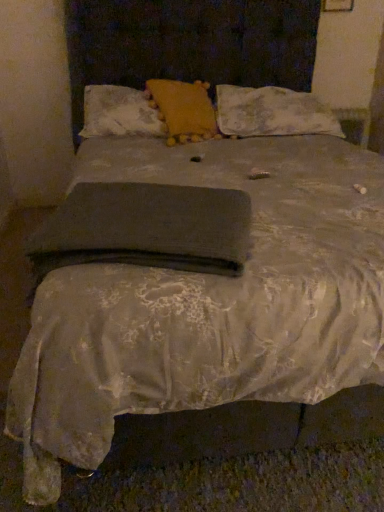
Measure the distance between dark gray fabric at center and camera.

The distance of dark gray fabric at center from camera is 36.14 inches.

What do you see at coordinates (272, 113) in the screenshot?
I see `floral lace pillow at upper right, which appears as the 3th pillow when viewed from the left` at bounding box center [272, 113].

Image resolution: width=384 pixels, height=512 pixels. I want to click on yellow fabric pillow at center, which ranks as the 2th pillow in right-to-left order, so click(184, 110).

Locate an element on the screen. dark gray fabric at center is located at coordinates (146, 228).

Which object is thinner, dark gray fabric at center or floral lace pillow at upper right, the 1th pillow when ordered from right to left?

With smaller width is dark gray fabric at center.

Which is more to the right, dark gray fabric at center or floral lace pillow at upper right, which appears as the 3th pillow when viewed from the left?

floral lace pillow at upper right, which appears as the 3th pillow when viewed from the left, is more to the right.

Is dark gray fabric at center not inside floral lace pillow at upper right, which appears as the 3th pillow when viewed from the left?

Yes.

Consider the image. Is dark gray fabric at center bigger or smaller than floral lace pillow at upper right, the 1th pillow when ordered from right to left?

In the image, dark gray fabric at center appears to be smaller than floral lace pillow at upper right, the 1th pillow when ordered from right to left.

Do you think matte yellow pillow at upper center, placed as the 3th pillow when sorted from right to left, is within yellow fabric pillow at center, which ranks as the 2th pillow in right-to-left order, or outside of it?

matte yellow pillow at upper center, placed as the 3th pillow when sorted from right to left, fits inside yellow fabric pillow at center, which ranks as the 2th pillow in right-to-left order.

Between matte yellow pillow at upper center, placed as the 3th pillow when sorted from right to left, and yellow fabric pillow at center, the second pillow from the left, which one appears on the right side from the viewer's perspective?

yellow fabric pillow at center, the second pillow from the left.

In the scene shown: In the image, is matte yellow pillow at upper center, which is counted as the 1th pillow, starting from the left, positioned in front of or behind yellow fabric pillow at center, the second pillow from the left?

matte yellow pillow at upper center, which is counted as the 1th pillow, starting from the left, is positioned farther from the viewer than yellow fabric pillow at center, the second pillow from the left.

From the image's perspective, is matte yellow pillow at upper center, placed as the 3th pillow when sorted from right to left, below yellow fabric pillow at center, which ranks as the 2th pillow in right-to-left order?

Yes, from the image's perspective, matte yellow pillow at upper center, placed as the 3th pillow when sorted from right to left, is below yellow fabric pillow at center, which ranks as the 2th pillow in right-to-left order.

From the image's perspective, who appears lower, yellow fabric pillow at center, the second pillow from the left, or dark gray fabric at center?

From the image's view, dark gray fabric at center is below.

How many degrees apart are the facing directions of yellow fabric pillow at center, the second pillow from the left, and dark gray fabric at center?

The facing directions of yellow fabric pillow at center, the second pillow from the left, and dark gray fabric at center are 34.8 degrees apart.

Does yellow fabric pillow at center, the second pillow from the left, appear on the right side of dark gray fabric at center?

Yes, yellow fabric pillow at center, the second pillow from the left, is to the right of dark gray fabric at center.

Does floral lace pillow at upper right, the 1th pillow when ordered from right to left, have a smaller size compared to dark gray fabric at center?

Actually, floral lace pillow at upper right, the 1th pillow when ordered from right to left, might be larger than dark gray fabric at center.

Does floral lace pillow at upper right, the 1th pillow when ordered from right to left, have a lesser height compared to dark gray fabric at center?

In fact, floral lace pillow at upper right, the 1th pillow when ordered from right to left, may be taller than dark gray fabric at center.

From a real-world perspective, does floral lace pillow at upper right, the 1th pillow when ordered from right to left, sit lower than dark gray fabric at center?

No, from a real-world perspective, floral lace pillow at upper right, the 1th pillow when ordered from right to left, is not under dark gray fabric at center.

How different are the orientations of floral lace pillow at upper right, which appears as the 3th pillow when viewed from the left, and dark gray fabric at center in degrees?

They differ by 16.7 degrees in their facing directions.

Consider the image. From a real-world perspective, is dark gray fabric at center physically below matte yellow pillow at upper center, which is counted as the 1th pillow, starting from the left?

Yes, from a real-world perspective, dark gray fabric at center is below matte yellow pillow at upper center, which is counted as the 1th pillow, starting from the left.

Is dark gray fabric at center taller than matte yellow pillow at upper center, which is counted as the 1th pillow, starting from the left?

Incorrect, the height of dark gray fabric at center is not larger of that of matte yellow pillow at upper center, which is counted as the 1th pillow, starting from the left.

From the image's perspective, who appears lower, dark gray fabric at center or matte yellow pillow at upper center, which is counted as the 1th pillow, starting from the left?

From the image's view, dark gray fabric at center is below.

Is dark gray fabric at center further to camera compared to matte yellow pillow at upper center, placed as the 3th pillow when sorted from right to left?

No.

How many degrees apart are the facing directions of floral lace pillow at upper right, which appears as the 3th pillow when viewed from the left, and yellow fabric pillow at center, which ranks as the 2th pillow in right-to-left order?

floral lace pillow at upper right, which appears as the 3th pillow when viewed from the left, and yellow fabric pillow at center, which ranks as the 2th pillow in right-to-left order, are facing 18.1 degrees away from each other.

From the image's perspective, does floral lace pillow at upper right, the 1th pillow when ordered from right to left, appear higher than yellow fabric pillow at center, the second pillow from the left?

Yes, from the image's perspective, floral lace pillow at upper right, the 1th pillow when ordered from right to left, is over yellow fabric pillow at center, the second pillow from the left.

Measure the distance from floral lace pillow at upper right, which appears as the 3th pillow when viewed from the left, to yellow fabric pillow at center, the second pillow from the left.

floral lace pillow at upper right, which appears as the 3th pillow when viewed from the left, is 10.41 inches away from yellow fabric pillow at center, the second pillow from the left.

Is floral lace pillow at upper right, the 1th pillow when ordered from right to left, bigger or smaller than yellow fabric pillow at center, the second pillow from the left?

In the image, floral lace pillow at upper right, the 1th pillow when ordered from right to left, appears to be larger than yellow fabric pillow at center, the second pillow from the left.

In the scene shown: Does yellow fabric pillow at center, the second pillow from the left, have a lesser width compared to floral lace pillow at upper right, the 1th pillow when ordered from right to left?

Indeed, yellow fabric pillow at center, the second pillow from the left, has a lesser width compared to floral lace pillow at upper right, the 1th pillow when ordered from right to left.

Is the depth of yellow fabric pillow at center, which ranks as the 2th pillow in right-to-left order, greater than that of floral lace pillow at upper right, the 1th pillow when ordered from right to left?

No, yellow fabric pillow at center, which ranks as the 2th pillow in right-to-left order, is closer to the camera.

Is yellow fabric pillow at center, the second pillow from the left, not close to floral lace pillow at upper right, which appears as the 3th pillow when viewed from the left?

Actually, yellow fabric pillow at center, the second pillow from the left, and floral lace pillow at upper right, which appears as the 3th pillow when viewed from the left, are a little close together.

Find the location of a particular element. Image resolution: width=384 pixels, height=512 pixels. pillow that is the 2nd one above the floral lace pillow at upper right, which appears as the 3th pillow when viewed from the left (from a real-world perspective) is located at coordinates (184, 110).

From the image's perspective, count 3rd pillows upward from the dark gray fabric at center and point to it. Please provide its 2D coordinates.

[(272, 113)]

You are a GUI agent. You are given a task and a screenshot of the screen. Output one action in this format:
    pyautogui.click(x=<x>, y=<y>)
    Task: Click on the pillow that appears in front of the matte yellow pillow at upper center, placed as the 3th pillow when sorted from right to left
    
    Given the screenshot: What is the action you would take?
    pyautogui.click(x=184, y=110)

Considering their positions, is floral lace pillow at upper right, the 1th pillow when ordered from right to left, positioned closer to dark gray fabric at center than matte yellow pillow at upper center, which is counted as the 1th pillow, starting from the left?

matte yellow pillow at upper center, which is counted as the 1th pillow, starting from the left, is positioned closer to the anchor dark gray fabric at center.

Estimate the real-world distances between objects in this image. Which object is further from dark gray fabric at center, matte yellow pillow at upper center, which is counted as the 1th pillow, starting from the left, or floral lace pillow at upper right, the 1th pillow when ordered from right to left?

floral lace pillow at upper right, the 1th pillow when ordered from right to left, is further to dark gray fabric at center.

When comparing their distances from matte yellow pillow at upper center, placed as the 3th pillow when sorted from right to left, does yellow fabric pillow at center, the second pillow from the left, or dark gray fabric at center seem closer?

Based on the image, yellow fabric pillow at center, the second pillow from the left, appears to be nearer to matte yellow pillow at upper center, placed as the 3th pillow when sorted from right to left.

When comparing their distances from matte yellow pillow at upper center, placed as the 3th pillow when sorted from right to left, does floral lace pillow at upper right, the 1th pillow when ordered from right to left, or dark gray fabric at center seem further?

dark gray fabric at center.

Estimate the real-world distances between objects in this image. Which object is further from dark gray fabric at center, yellow fabric pillow at center, the second pillow from the left, or floral lace pillow at upper right, which appears as the 3th pillow when viewed from the left?

floral lace pillow at upper right, which appears as the 3th pillow when viewed from the left, lies further to dark gray fabric at center than the other object.

Based on their spatial positions, is yellow fabric pillow at center, which ranks as the 2th pillow in right-to-left order, or dark gray fabric at center further from floral lace pillow at upper right, the 1th pillow when ordered from right to left?

dark gray fabric at center lies further to floral lace pillow at upper right, the 1th pillow when ordered from right to left, than the other object.

Considering their positions, is yellow fabric pillow at center, the second pillow from the left, positioned closer to matte yellow pillow at upper center, placed as the 3th pillow when sorted from right to left, than floral lace pillow at upper right, which appears as the 3th pillow when viewed from the left?

The object closer to matte yellow pillow at upper center, placed as the 3th pillow when sorted from right to left, is yellow fabric pillow at center, the second pillow from the left.

When comparing their distances from matte yellow pillow at upper center, which is counted as the 1th pillow, starting from the left, does dark gray fabric at center or yellow fabric pillow at center, which ranks as the 2th pillow in right-to-left order, seem further?

dark gray fabric at center is positioned further to the anchor matte yellow pillow at upper center, which is counted as the 1th pillow, starting from the left.

Find the location of a particular element. The width and height of the screenshot is (384, 512). pillow positioned between dark gray fabric at center and matte yellow pillow at upper center, which is counted as the 1th pillow, starting from the left, from near to far is located at coordinates (184, 110).

Identify the location of pillow situated between matte yellow pillow at upper center, which is counted as the 1th pillow, starting from the left, and floral lace pillow at upper right, the 1th pillow when ordered from right to left, from left to right. (184, 110).